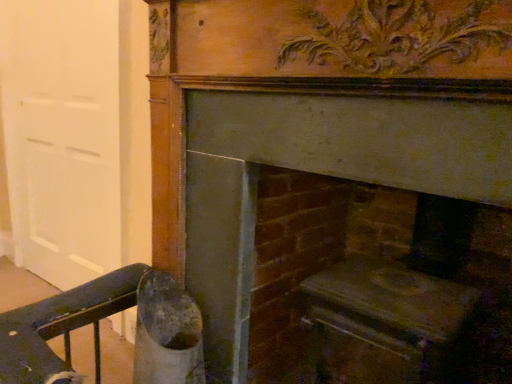
Question: Is wooden fireplace at center, the second fireplace viewed from the right, closer to the viewer compared to smooth stone hearth at center, positioned as the first fireplace in right-to-left order?

Choices:
 (A) no
 (B) yes

Answer: (B)

Question: Does wooden fireplace at center, marked as the 1th fireplace in a left-to-right arrangement, have a greater height compared to smooth stone hearth at center, positioned as the first fireplace in right-to-left order?

Choices:
 (A) yes
 (B) no

Answer: (A)

Question: Can you confirm if wooden fireplace at center, marked as the 1th fireplace in a left-to-right arrangement, is smaller than smooth stone hearth at center, which is the 2th fireplace in left-to-right order?

Choices:
 (A) no
 (B) yes

Answer: (B)

Question: Is wooden fireplace at center, marked as the 1th fireplace in a left-to-right arrangement, oriented away from smooth stone hearth at center, which is the 2th fireplace in left-to-right order?

Choices:
 (A) no
 (B) yes

Answer: (B)

Question: Is wooden fireplace at center, marked as the 1th fireplace in a left-to-right arrangement, positioned far away from smooth stone hearth at center, positioned as the first fireplace in right-to-left order?

Choices:
 (A) no
 (B) yes

Answer: (A)

Question: Is wooden fireplace at center, marked as the 1th fireplace in a left-to-right arrangement, with smooth stone hearth at center, positioned as the first fireplace in right-to-left order?

Choices:
 (A) yes
 (B) no

Answer: (A)

Question: Is white matte door at left looking in the opposite direction of smooth stone hearth at center, which is the 2th fireplace in left-to-right order?

Choices:
 (A) no
 (B) yes

Answer: (A)

Question: Can you confirm if white matte door at left is taller than smooth stone hearth at center, which is the 2th fireplace in left-to-right order?

Choices:
 (A) yes
 (B) no

Answer: (A)

Question: Could you tell me if white matte door at left is turned towards smooth stone hearth at center, positioned as the first fireplace in right-to-left order?

Choices:
 (A) yes
 (B) no

Answer: (B)

Question: Does white matte door at left appear on the right side of smooth stone hearth at center, positioned as the first fireplace in right-to-left order?

Choices:
 (A) yes
 (B) no

Answer: (B)

Question: Is white matte door at left outside of smooth stone hearth at center, positioned as the first fireplace in right-to-left order?

Choices:
 (A) no
 (B) yes

Answer: (B)

Question: From a real-world perspective, is white matte door at left under smooth stone hearth at center, which is the 2th fireplace in left-to-right order?

Choices:
 (A) no
 (B) yes

Answer: (A)

Question: Can you confirm if smooth stone hearth at center, positioned as the first fireplace in right-to-left order, is shorter than white matte door at left?

Choices:
 (A) no
 (B) yes

Answer: (B)